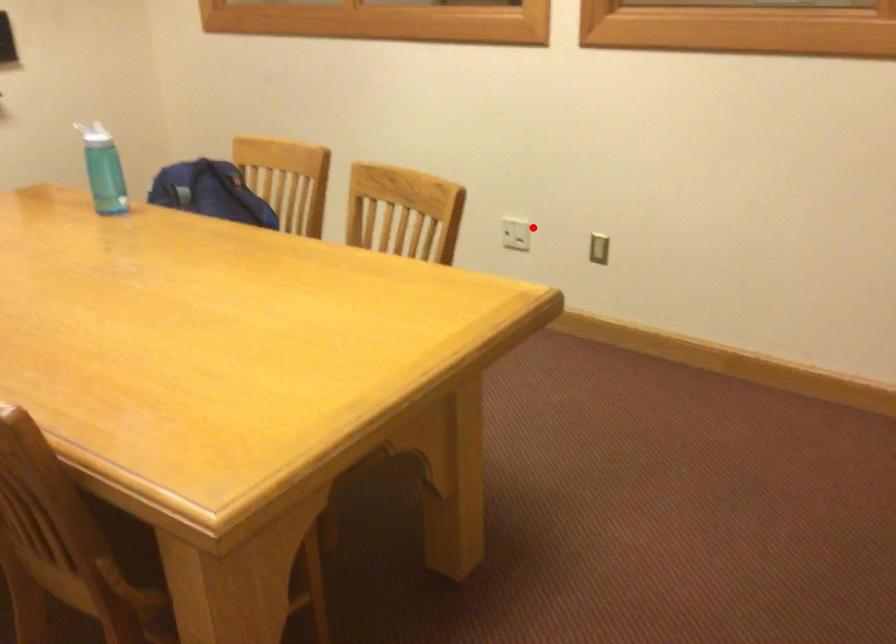
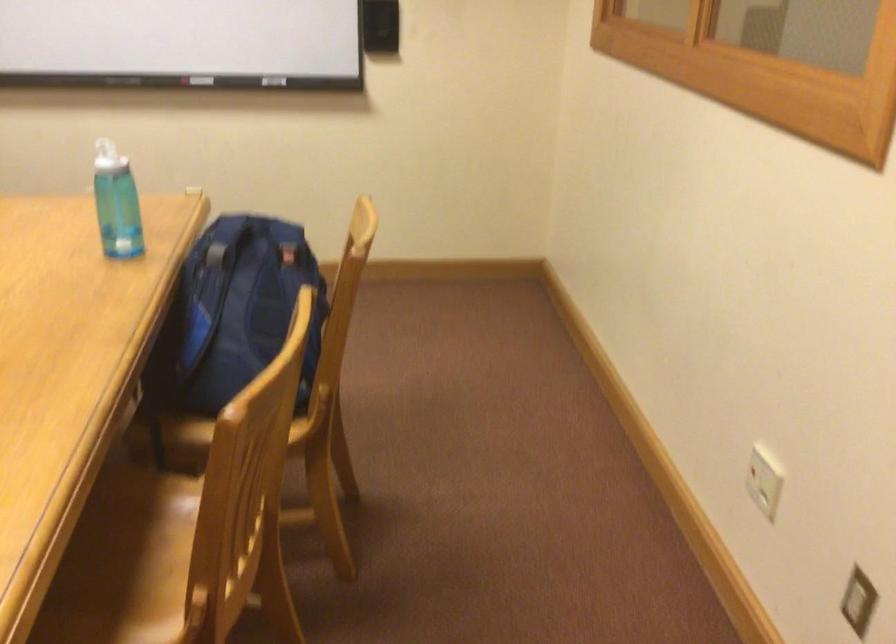
Question: A red point is marked in image1. In image2, is the corresponding 3D point closer to the camera or farther? Reply with the corresponding letter.

Choices:
 (A) The corresponding 3D point is closer.
 (B) The corresponding 3D point is farther.

Answer: (A)